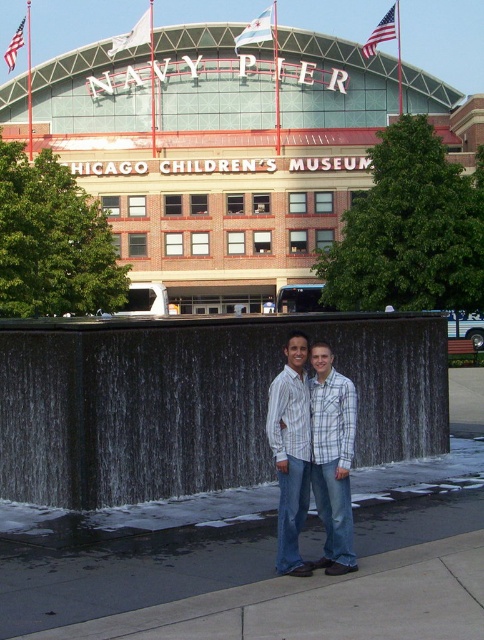
Question: Among these objects, which one is nearest to the camera?

Choices:
 (A) black stone waterfall at center
 (B) smooth concrete sidewalk at center
 (C) plaid shirt at center
 (D) glass dome at center

Answer: (C)

Question: Is black stone waterfall at center smaller than smooth concrete sidewalk at center?

Choices:
 (A) yes
 (B) no

Answer: (B)

Question: Is glass dome at center above plaid shirt at center?

Choices:
 (A) no
 (B) yes

Answer: (B)

Question: Which point is farther to the camera?

Choices:
 (A) (20, 625)
 (B) (142, 435)
 (C) (167, 259)
 (D) (320, 417)

Answer: (C)

Question: In this image, where is smooth concrete sidewalk at center located relative to plaid shirt at center?

Choices:
 (A) above
 (B) below

Answer: (B)

Question: Which point appears closest to the camera in this image?

Choices:
 (A) (399, 396)
 (B) (295, 436)
 (C) (183, 156)
 (D) (161, 545)

Answer: (B)